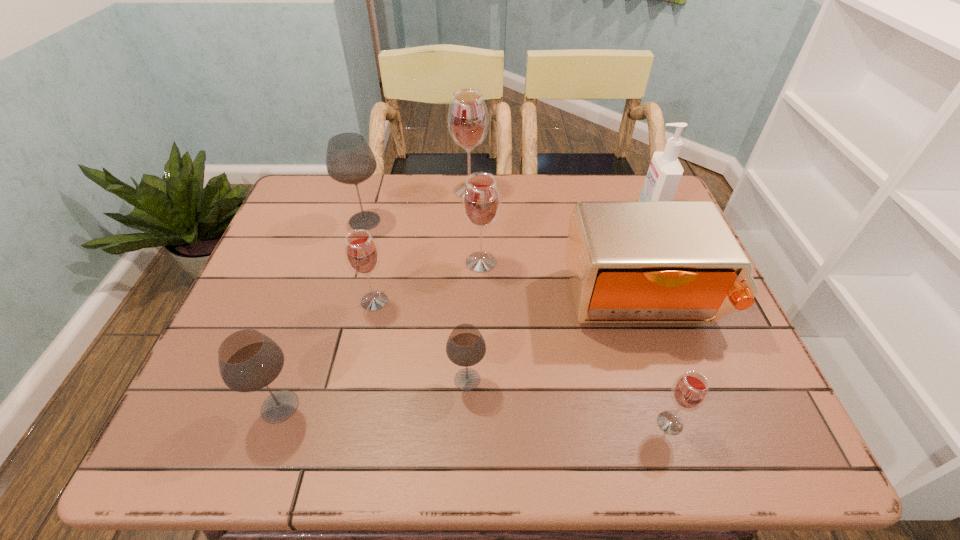
The height and width of the screenshot is (540, 960). I want to click on vacant area that lies between the second smallest red wineglass and the farthest red wineglass, so click(421, 246).

At what (x,y) coordinates should I click in order to perform the action: click on free space that is in between the cleansing agent and the second biggest gray wineglass. Please return your answer as a coordinate pair (x, y). Image resolution: width=960 pixels, height=540 pixels. Looking at the image, I should click on (466, 309).

Image resolution: width=960 pixels, height=540 pixels. I want to click on vacant space in between the cleansing agent and the second nearest red wineglass, so click(513, 256).

Find the location of a particular element. The height and width of the screenshot is (540, 960). object that stands as the seventh closest to the tallest wineglass is located at coordinates (248, 360).

The image size is (960, 540). Find the location of `object that is the seventh closest to the rightmost gray wineglass`. object that is the seventh closest to the rightmost gray wineglass is located at coordinates (468, 120).

Choose which wineglass is the nearest neighbor to the third nearest red wineglass. Please provide its 2D coordinates. Your answer should be formatted as a tuple, i.e. [(x, y)], where the tuple contains the x and y coordinates of a point satisfying the conditions above.

[(362, 255)]

Select which wineglass appears as the third closest to the rightmost wineglass. Please provide its 2D coordinates. Your answer should be formatted as a tuple, i.e. [(x, y)], where the tuple contains the x and y coordinates of a point satisfying the conditions above.

[(362, 255)]

Identify which red wineglass is located as the second nearest to the cleansing agent. Please provide its 2D coordinates. Your answer should be formatted as a tuple, i.e. [(x, y)], where the tuple contains the x and y coordinates of a point satisfying the conditions above.

[(468, 120)]

The height and width of the screenshot is (540, 960). I want to click on red wineglass that stands as the second closest to the third nearest red wineglass, so click(x=468, y=120).

I want to click on gray wineglass that is the third closest to the fifth nearest wineglass, so click(248, 360).